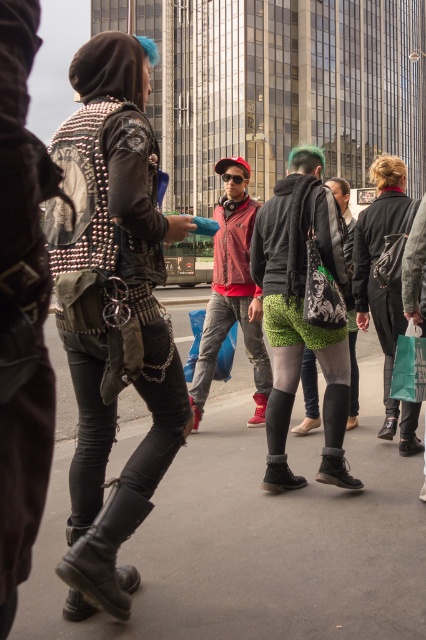
You are a photographer trying to capture a candid shot of the two people in the scene. The green textured shorts at center and the black leather boot at lower left are both in your viewfinder. Based on their positions, which object is located more to the right side?

The green textured shorts at center is positioned on the right side of the black leather boot at lower left, so the green textured shorts at center is more to the right.

You are a delivery drone flying above the urban street scene. You need to land on the gray asphalt pavement at center without hitting the studded leather jacket at left. Based on their heights, can you safely land there?

The gray asphalt pavement at center has a lesser height compared to the studded leather jacket at left, so yes, the delivery drone can safely land on the gray asphalt pavement at center as it is lower than the studded leather jacket at left.

You are a photographer trying to capture a candid shot of the two people in the scene. The green textured shorts at center and the black leather boot at lower left are part of two different individuals. Given their distance apart, can you fit both subjects into a single frame without zooming in? Explain your reasoning.

The green textured shorts at center and the black leather boot at lower left are 5.81 feet apart. Since the distance between them is relatively small, it is possible to fit both subjects into a single frame without zooming in, provided the camera has a wide enough lens to accommodate the 5.81 feet separation between them.